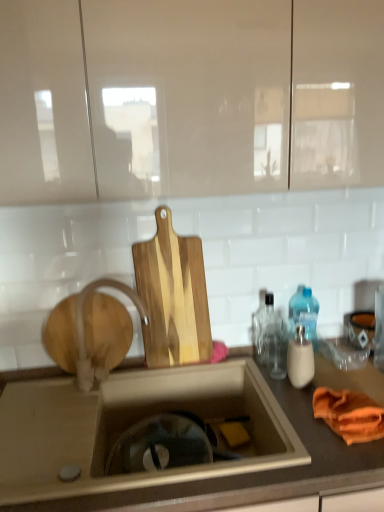
Question: Would you say natural wood cutting board at center is part of translucent glass bottle at right, which is the first bottle from front to back,'s contents?

Choices:
 (A) no
 (B) yes

Answer: (A)

Question: Does translucent glass bottle at right, which is the first bottle from front to back, have a greater width compared to natural wood cutting board at center?

Choices:
 (A) yes
 (B) no

Answer: (A)

Question: Does translucent glass bottle at right, positioned as the third bottle in back-to-front order, have a lesser width compared to natural wood cutting board at center?

Choices:
 (A) yes
 (B) no

Answer: (B)

Question: Does translucent glass bottle at right, positioned as the third bottle in back-to-front order, have a larger size compared to natural wood cutting board at center?

Choices:
 (A) no
 (B) yes

Answer: (A)

Question: Does translucent glass bottle at right, which is the first bottle from front to back, lie behind natural wood cutting board at center?

Choices:
 (A) no
 (B) yes

Answer: (A)

Question: Can you confirm if translucent glass bottle at right, which is the first bottle from front to back, is taller than natural wood cutting board at center?

Choices:
 (A) yes
 (B) no

Answer: (B)

Question: Is natural wood cutting board at center aimed at wooden at left?

Choices:
 (A) no
 (B) yes

Answer: (A)

Question: Considering the relative sizes of natural wood cutting board at center and wooden at left in the image provided, is natural wood cutting board at center taller than wooden at left?

Choices:
 (A) yes
 (B) no

Answer: (A)

Question: Is natural wood cutting board at center not close to wooden at left?

Choices:
 (A) yes
 (B) no

Answer: (B)

Question: Is natural wood cutting board at center looking in the opposite direction of wooden at left?

Choices:
 (A) yes
 (B) no

Answer: (B)

Question: Can you confirm if natural wood cutting board at center is shorter than wooden at left?

Choices:
 (A) no
 (B) yes

Answer: (A)

Question: From the image's perspective, would you say natural wood cutting board at center is shown under wooden at left?

Choices:
 (A) yes
 (B) no

Answer: (B)

Question: From the image's perspective, does white matte faucet at center appear higher than translucent plastic bottle at right, which ranks as the third bottle in front-to-back order?

Choices:
 (A) no
 (B) yes

Answer: (A)